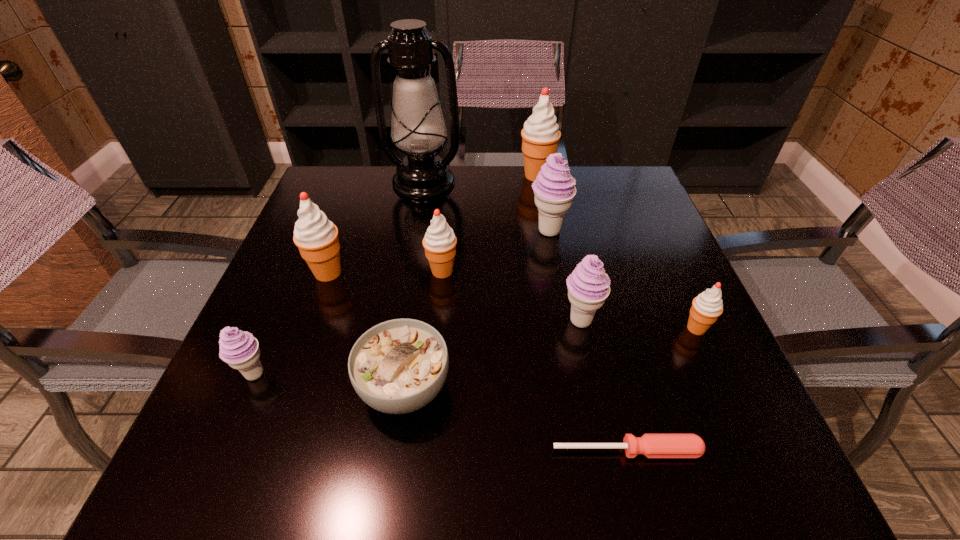
At what (x,y) coordinates should I click in order to perform the action: click on icecream that is the second closest one to the smallest red icecream. Please return your answer as a coordinate pair (x, y). The image size is (960, 540). Looking at the image, I should click on [x=554, y=189].

Select which icecream is the closest to the biggest red icecream. Please provide its 2D coordinates. Your answer should be formatted as a tuple, i.e. [(x, y)], where the tuple contains the x and y coordinates of a point satisfying the conditions above.

[(554, 189)]

Image resolution: width=960 pixels, height=540 pixels. Identify the location of red icecream that is the third closest to the leftmost red icecream. (706, 308).

Image resolution: width=960 pixels, height=540 pixels. Identify the location of red icecream that is the third closest one to the third farthest object. (706, 308).

Identify which purple icecream is located as the third nearest to the second biggest red icecream. Please provide its 2D coordinates. Your answer should be formatted as a tuple, i.e. [(x, y)], where the tuple contains the x and y coordinates of a point satisfying the conditions above.

[(588, 286)]

Find the location of a particular element. Image resolution: width=960 pixels, height=540 pixels. purple icecream that can be found as the second closest to the nearest icecream is located at coordinates (554, 189).

You are a GUI agent. You are given a task and a screenshot of the screen. Output one action in this format:
    pyautogui.click(x=<x>, y=<y>)
    Task: Click on the blank area in the image that satisfies the following two spatial constraints: 1. on the front side of the red screwdriver; 2. on the right side of the tallest icecream
    This screenshot has width=960, height=540.
    Given the screenshot: What is the action you would take?
    pos(585,450)

Find the location of a particular element. This screenshot has height=540, width=960. vacant area that satisfies the following two spatial constraints: 1. on the front side of the eighth nearest object; 2. on the right side of the black oil lamp is located at coordinates (416, 231).